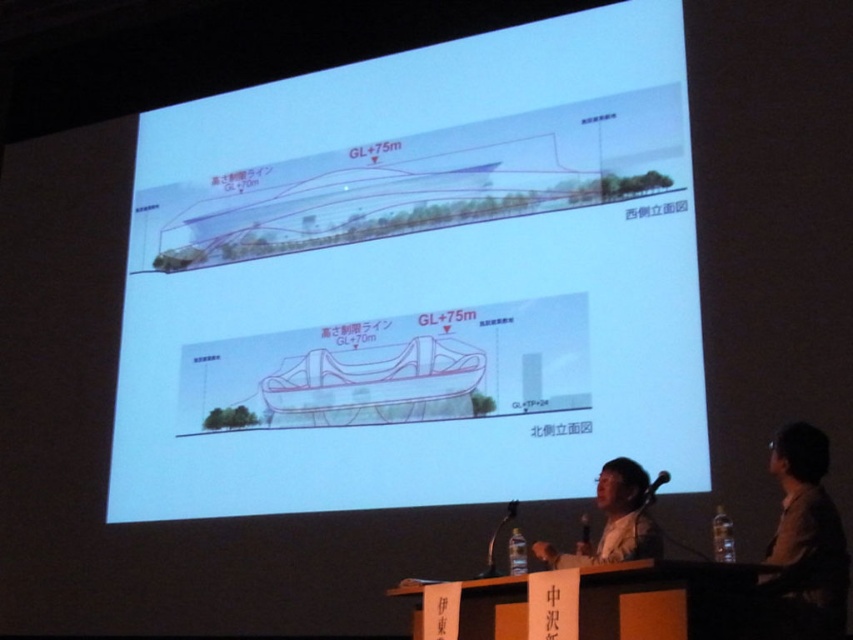
Question: Estimate the real-world distances between objects in this image. Which object is closer to the brown shirt at right?

Choices:
 (A) matte black person at lower center
 (B) white paper at center

Answer: (A)

Question: Is white paper at center smaller than brown shirt at right?

Choices:
 (A) no
 (B) yes

Answer: (A)

Question: Among these points, which one is farthest from the camera?

Choices:
 (A) (595, 29)
 (B) (633, 484)

Answer: (A)

Question: Estimate the real-world distances between objects in this image. Which object is farther from the white paper at center?

Choices:
 (A) matte black person at lower center
 (B) brown shirt at right

Answer: (B)

Question: In this image, where is white paper at center located relative to matte black person at lower center?

Choices:
 (A) below
 (B) above

Answer: (B)

Question: Does brown shirt at right have a larger size compared to matte black person at lower center?

Choices:
 (A) yes
 (B) no

Answer: (A)